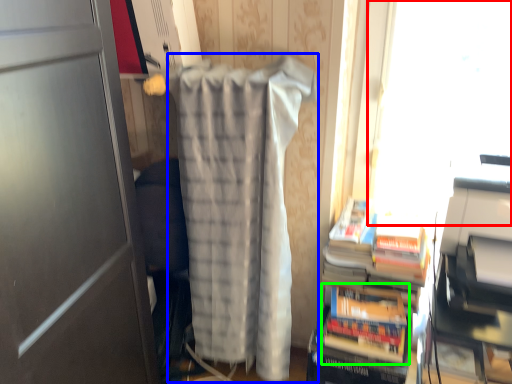
Question: Which object is the farthest from window screen (highlighted by a red box)? Choose among these: blanket (highlighted by a blue box) or paperback book (highlighted by a green box).

Choices:
 (A) blanket
 (B) paperback book

Answer: (A)